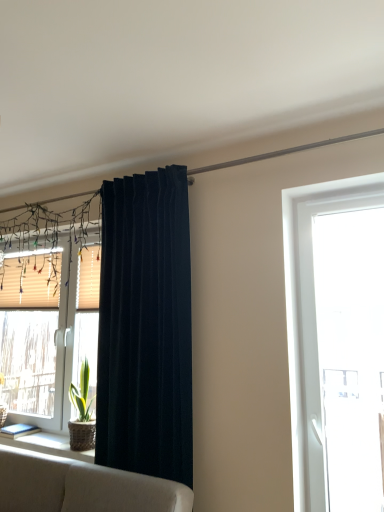
The width and height of the screenshot is (384, 512). In order to click on free space above beige wood shutter at left, acting as the second shutter starting from the right (from a real-world perspective) in this screenshot , I will do `click(35, 255)`.